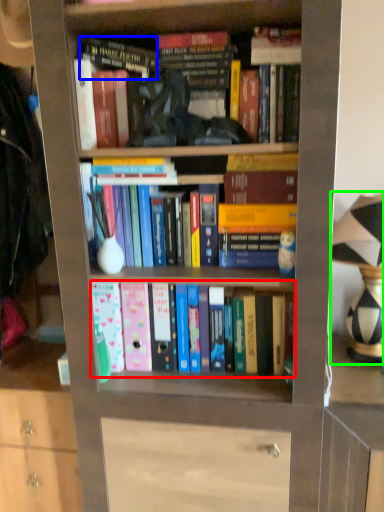
Question: Which is farther away from book (highlighted by a red box)? book (highlighted by a blue box) or table lamp (highlighted by a green box)?

Choices:
 (A) book
 (B) table lamp

Answer: (A)